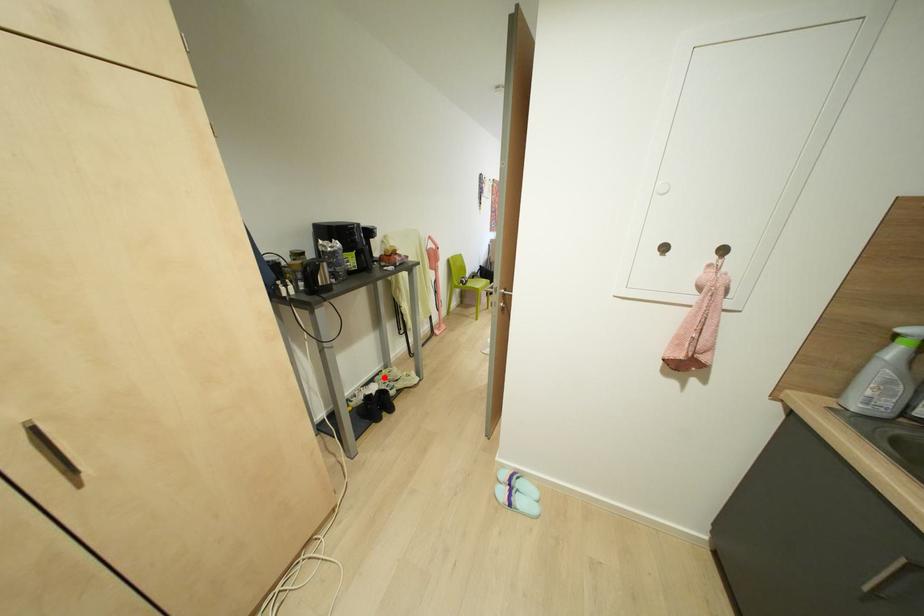
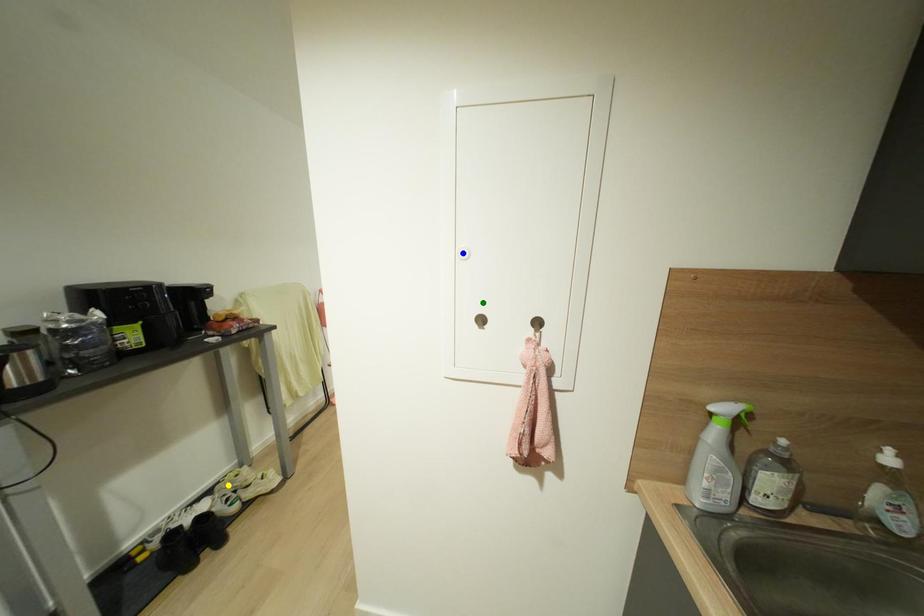
Question: I am providing you with two images of the same scene from different viewpoints. A red point is marked on the first image. You are given multiple points on the second image. Which point in image 2 represents the same 3d spot as the red point in image 1?

Choices:
 (A) blue point
 (B) green point
 (C) yellow point

Answer: (C)